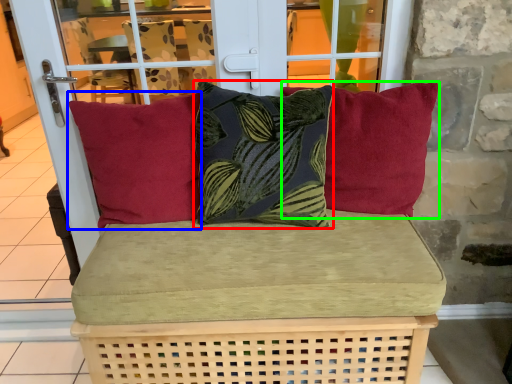
Question: Considering the real-world distances, which object is farthest from pillow (highlighted by a red box)? pillow (highlighted by a blue box) or pillow (highlighted by a green box)?

Choices:
 (A) pillow
 (B) pillow

Answer: (B)